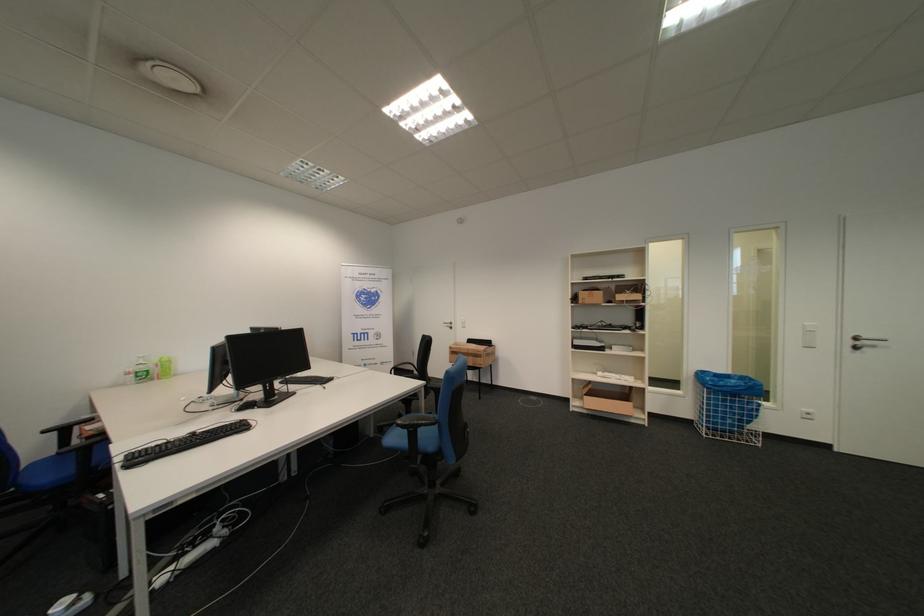
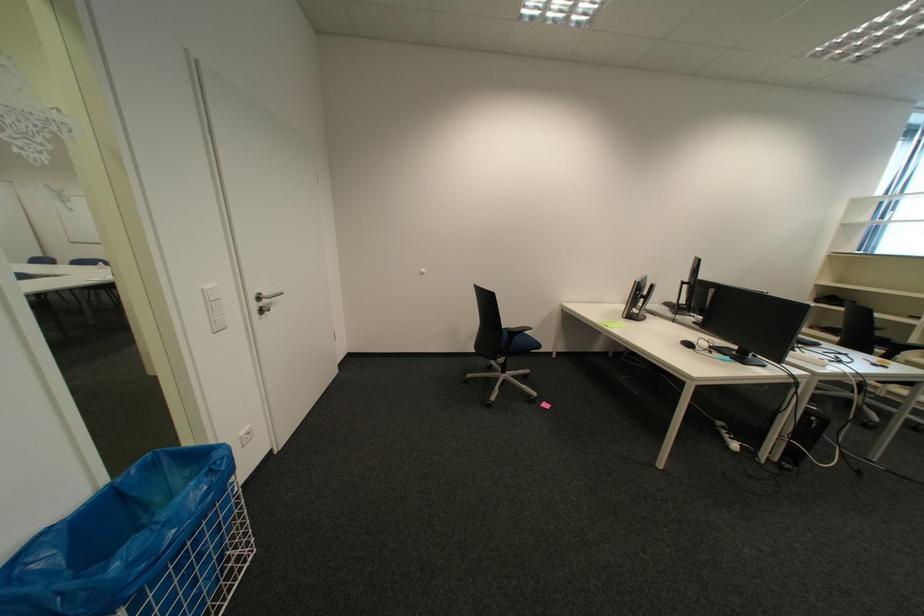
The point at (862, 344) is marked in the first image. Where is the corresponding point in the second image?

(266, 307)